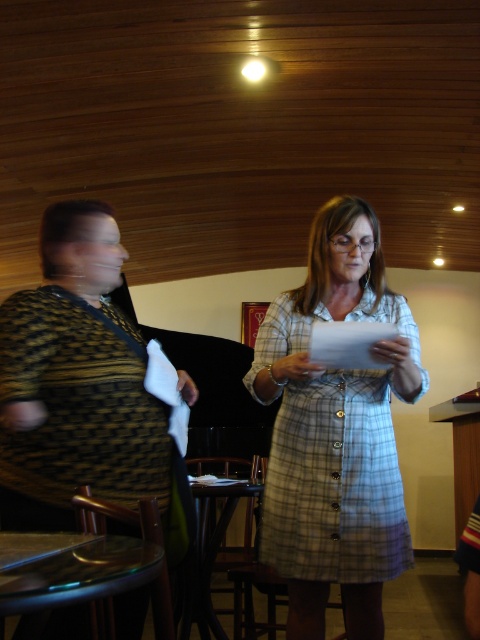
You are organizing a fashion show and need to arrange two dresses on a runway. The runway has a raised platform at the back. You have the plaid cotton dress at center and the patterned fabric dress at left. Which dress should be placed on the platform so that it appears higher than the other?

The patterned fabric dress at left should be placed on the platform because the plaid cotton dress at center is below it, so positioning the patterned fabric dress higher will maintain their relative positions.

You are organizing a photoshoot and need to know which dress takes up more space in the frame. Based on the scene, which dress is larger in size between the plaid cotton dress at center and the patterned fabric dress at left?

The patterned fabric dress at left is larger in size than the plaid cotton dress at center because the plaid cotton dress at center occupies less space than patterned fabric dress at left.